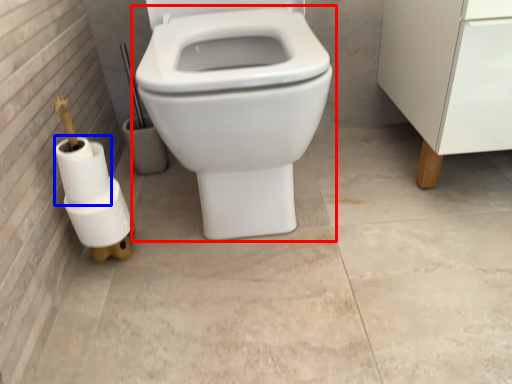
Question: Among these objects, which one is farthest to the camera, toilet (highlighted by a red box) or toilet paper (highlighted by a blue box)?

Choices:
 (A) toilet
 (B) toilet paper

Answer: (B)